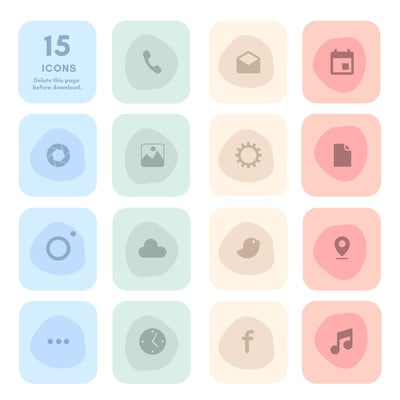
The width and height of the screenshot is (400, 400). I want to click on pictures, so click(x=160, y=161).